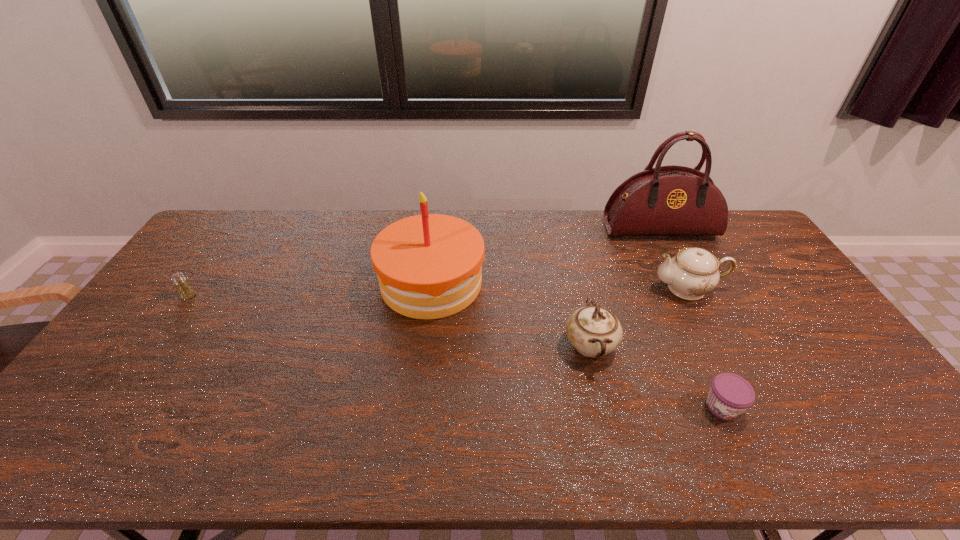
This screenshot has height=540, width=960. Find the location of `object that stands as the closest to the second object from left to right`. object that stands as the closest to the second object from left to right is located at coordinates (594, 331).

Where is `free spot that satisfies the following two spatial constraints: 1. on the front-facing side of the farthest object; 2. at the spout of the farther chinaware`? free spot that satisfies the following two spatial constraints: 1. on the front-facing side of the farthest object; 2. at the spout of the farther chinaware is located at coordinates (689, 288).

Locate an element on the screen. free location that satisfies the following two spatial constraints: 1. on the front side of the saltshaker; 2. on the right side of the left chinaware is located at coordinates (154, 346).